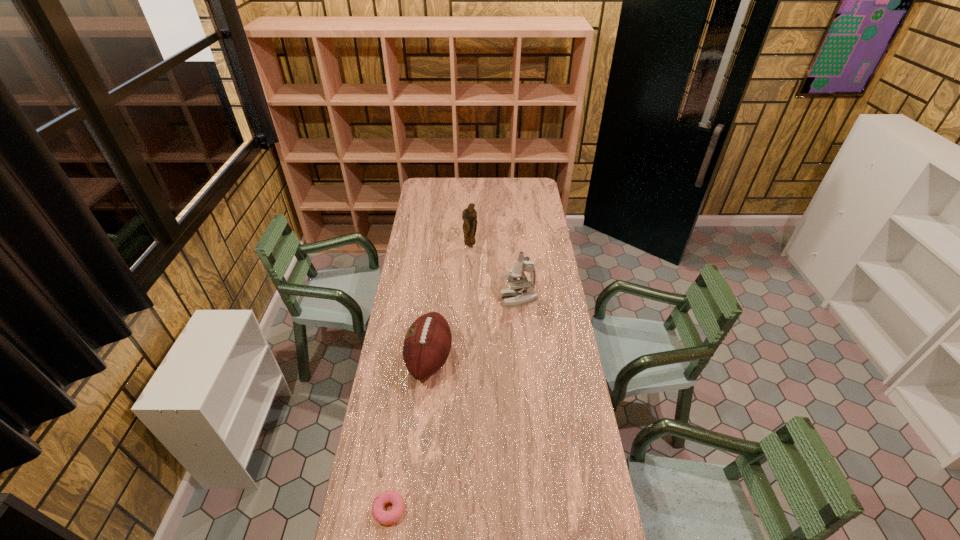
Identify which object is the third nearest to the microscope. Please provide its 2D coordinates. Your answer should be formatted as a tuple, i.e. [(x, y)], where the tuple contains the x and y coordinates of a point satisfying the conditions above.

[(383, 517)]

The width and height of the screenshot is (960, 540). Find the location of `vacant position in the image that satisfies the following two spatial constraints: 1. on the front-facing side of the figurine; 2. on the left side of the microscope`. vacant position in the image that satisfies the following two spatial constraints: 1. on the front-facing side of the figurine; 2. on the left side of the microscope is located at coordinates (468, 299).